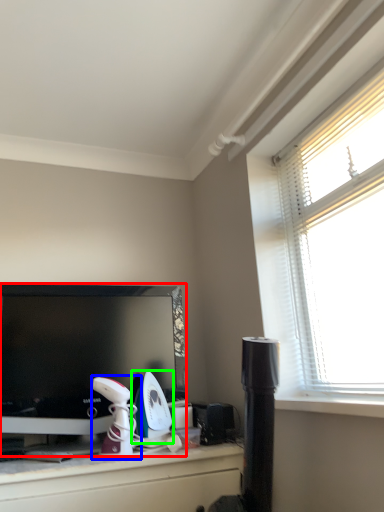
Question: Estimate the real-world distances between objects in this image. Which object is farther from television (highlighted by a red box), appliance (highlighted by a blue box) or appliance (highlighted by a green box)?

Choices:
 (A) appliance
 (B) appliance

Answer: (B)